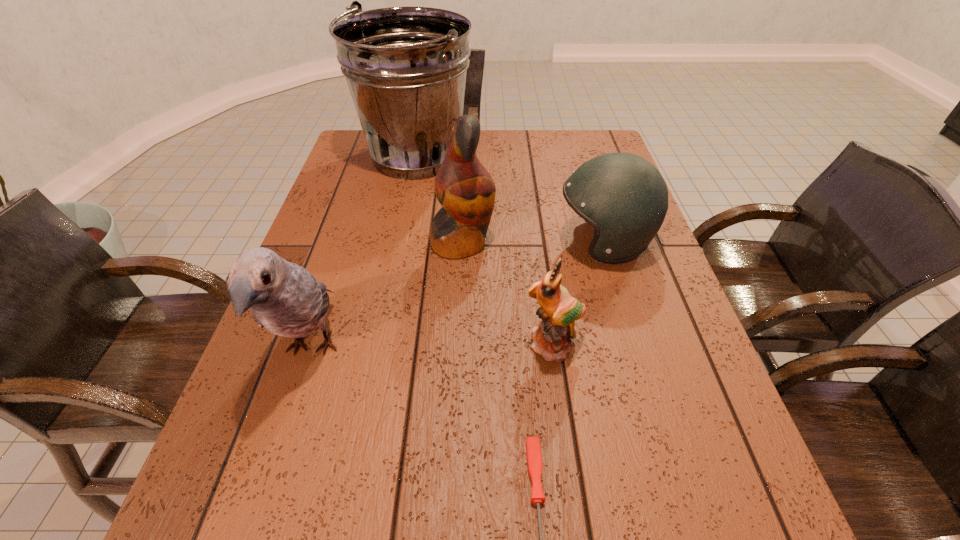
Find the location of a particular element. This screenshot has height=540, width=960. vacant space at the left edge of the desktop is located at coordinates (341, 309).

Locate an element on the screen. This screenshot has height=540, width=960. free space at the right edge is located at coordinates (628, 269).

Locate an element on the screen. vacant space in between the farthest parrot and the rightmost parrot is located at coordinates (508, 294).

The width and height of the screenshot is (960, 540). Identify the location of vacant region between the leftmost parrot and the football helmet. (457, 295).

I want to click on unoccupied position between the shortest parrot and the football helmet, so click(x=578, y=294).

You are a GUI agent. You are given a task and a screenshot of the screen. Output one action in this format:
    pyautogui.click(x=<x>, y=<y>)
    Task: Click on the free space between the football helmet and the rightmost parrot
    The image size is (960, 540).
    Given the screenshot: What is the action you would take?
    pyautogui.click(x=578, y=294)

Identify the location of object identified as the second closest to the second tallest parrot. (533, 447).

I want to click on object that is the second nearest to the second parrot from right to left, so click(x=406, y=67).

Identify which parrot is located as the third nearest to the nearest object. Please provide its 2D coordinates. Your answer should be formatted as a tuple, i.e. [(x, y)], where the tuple contains the x and y coordinates of a point satisfying the conditions above.

[(466, 191)]

Select which parrot appears as the closest to the football helmet. Please provide its 2D coordinates. Your answer should be formatted as a tuple, i.e. [(x, y)], where the tuple contains the x and y coordinates of a point satisfying the conditions above.

[(466, 191)]